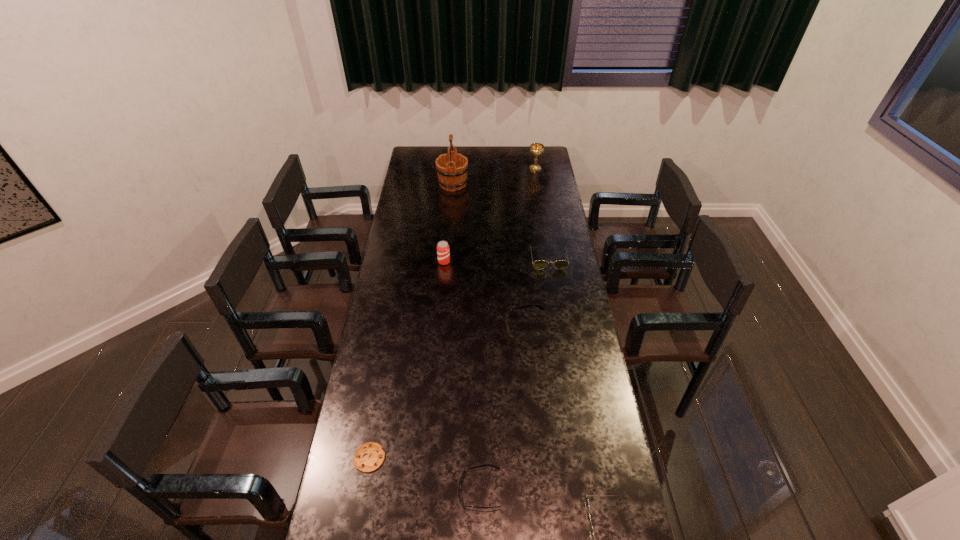
In the image, there is a desktop. Find the location of `vacant space at the far edge`. vacant space at the far edge is located at coordinates (497, 162).

Find the location of a particular element. This screenshot has width=960, height=540. free space at the left edge of the desktop is located at coordinates (417, 196).

Where is `free region at the right edge of the desktop`? free region at the right edge of the desktop is located at coordinates (556, 196).

At what (x,y) coordinates should I click in order to perform the action: click on vacant space at the far left corner. Please return your answer as a coordinate pair (x, y). This screenshot has width=960, height=540. Looking at the image, I should click on (412, 149).

Identify the location of free space between the leftmost sunglasses and the leftmost object. (425, 474).

Find the location of a particular element. This screenshot has width=960, height=540. empty space between the shortest object and the farthest object is located at coordinates (452, 313).

The width and height of the screenshot is (960, 540). In order to click on blank region between the second farthest object and the left black sunglasses in this screenshot , I will do `click(467, 337)`.

This screenshot has height=540, width=960. I want to click on free area in between the second farthest object and the chalice, so click(x=494, y=177).

You are a GUI agent. You are given a task and a screenshot of the screen. Output one action in this format:
    pyautogui.click(x=<x>, y=<y>)
    Task: Click on the unoccupied position between the tallest object and the farther green sunglasses
    
    Given the screenshot: What is the action you would take?
    pyautogui.click(x=500, y=221)

Where is `blank region between the seventh nearest object and the farthest object`? This screenshot has width=960, height=540. blank region between the seventh nearest object and the farthest object is located at coordinates (494, 177).